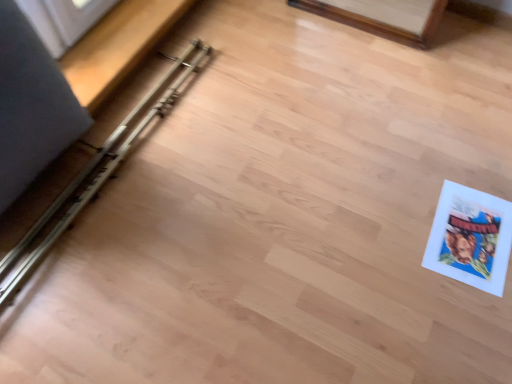
Where is `vacant space underneath metallic silver rail at left (from a real-world perspective)`? The height and width of the screenshot is (384, 512). vacant space underneath metallic silver rail at left (from a real-world perspective) is located at coordinates 126,142.